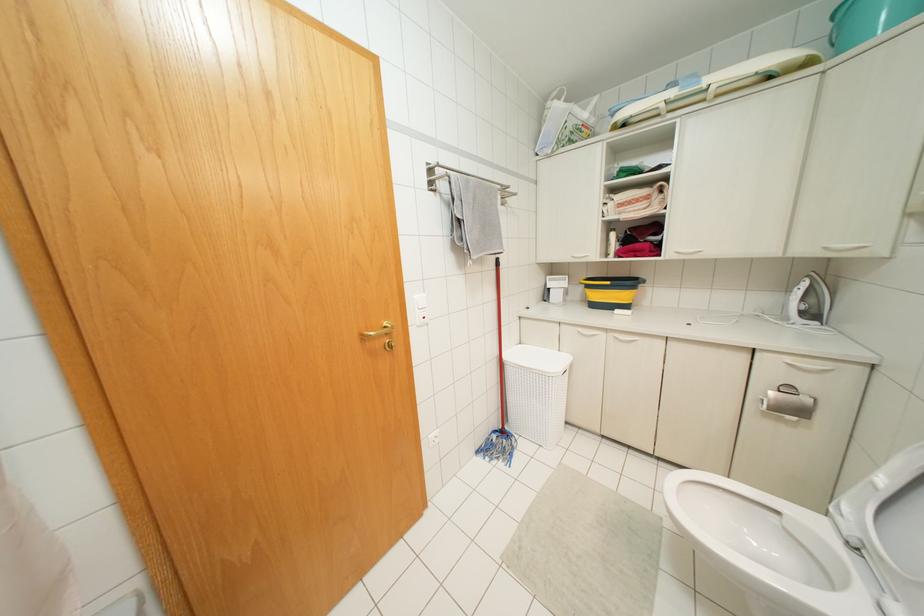
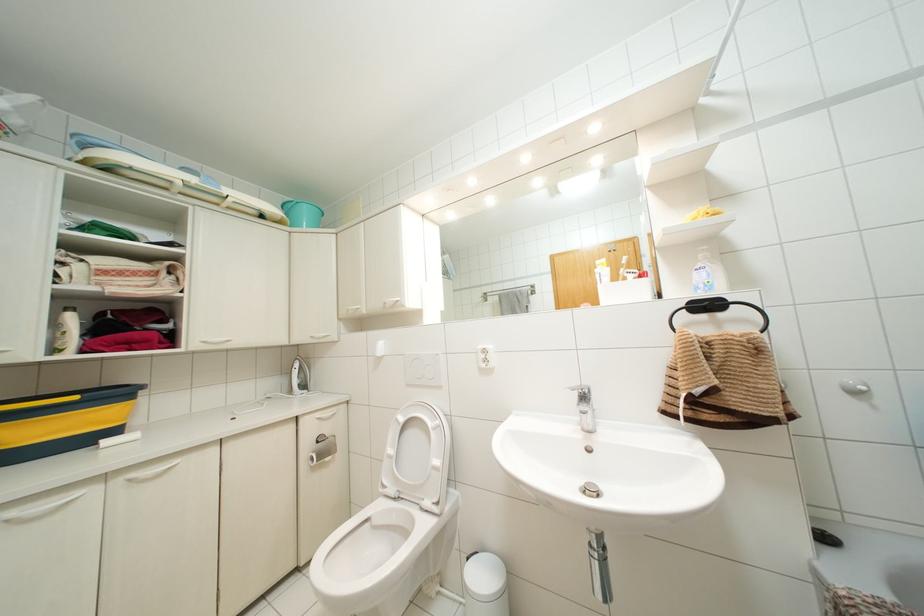
Find the pixel in the second image that matches the point at 612,235 in the first image.

(70, 317)